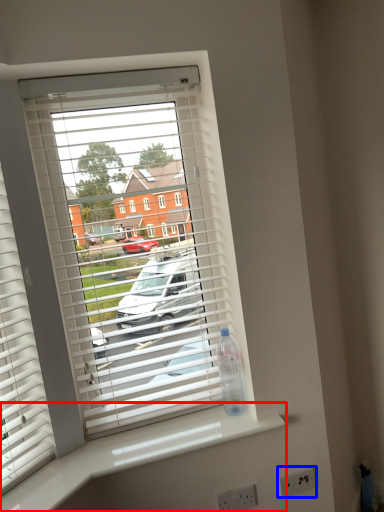
Question: Which point is closer to the camera, counter top (highlighted by a red box) or electric outlet (highlighted by a blue box)?

Choices:
 (A) counter top
 (B) electric outlet

Answer: (A)